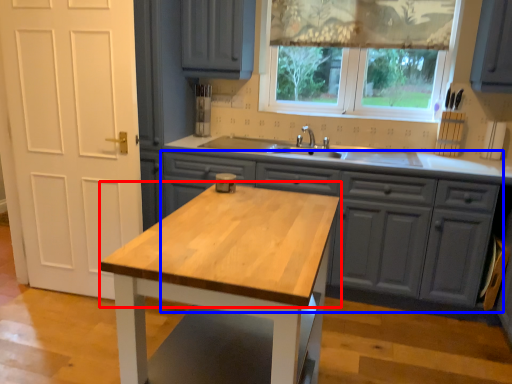
Question: Which of the following is the closest to the observer, countertop (highlighted by a red box) or cabinetry (highlighted by a blue box)?

Choices:
 (A) countertop
 (B) cabinetry

Answer: (A)